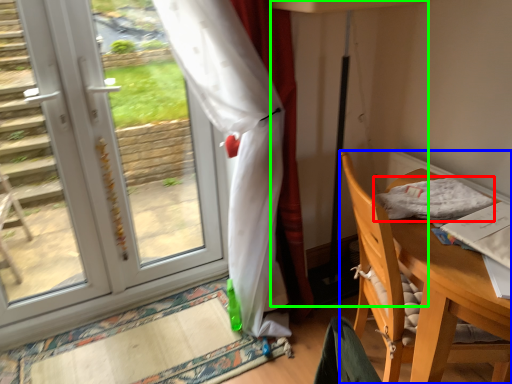
Question: Based on their relative distances, which object is nearer to cloth (highlighted by a red box)? Choose from chair (highlighted by a blue box) and table lamp (highlighted by a green box).

Choices:
 (A) chair
 (B) table lamp

Answer: (A)